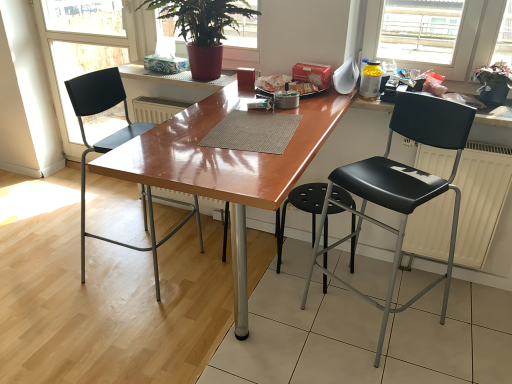
Locate an element on the screen. Image resolution: width=512 pixels, height=384 pixels. vacant area that is situated to the right of black leather chair at right, the second chair from the left is located at coordinates (462, 326).